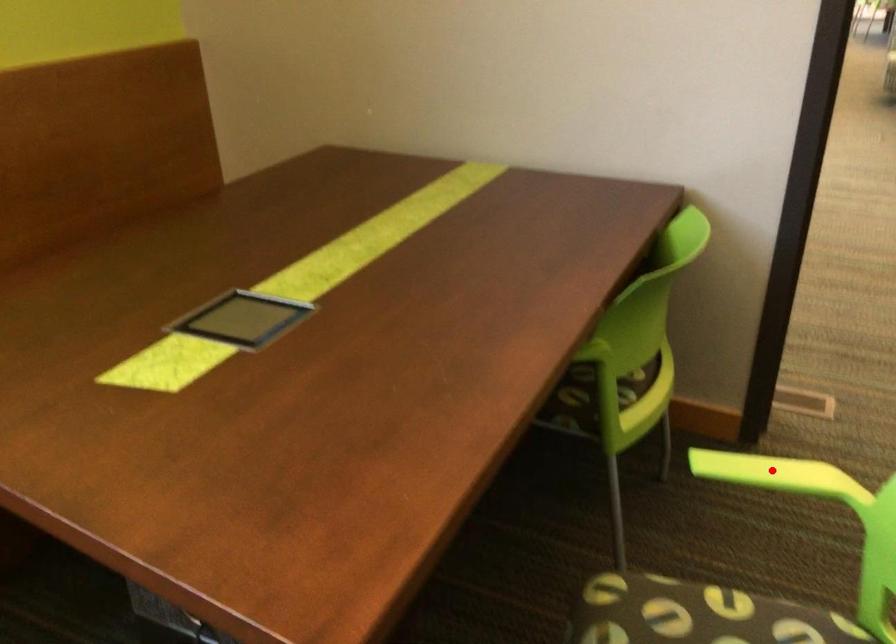
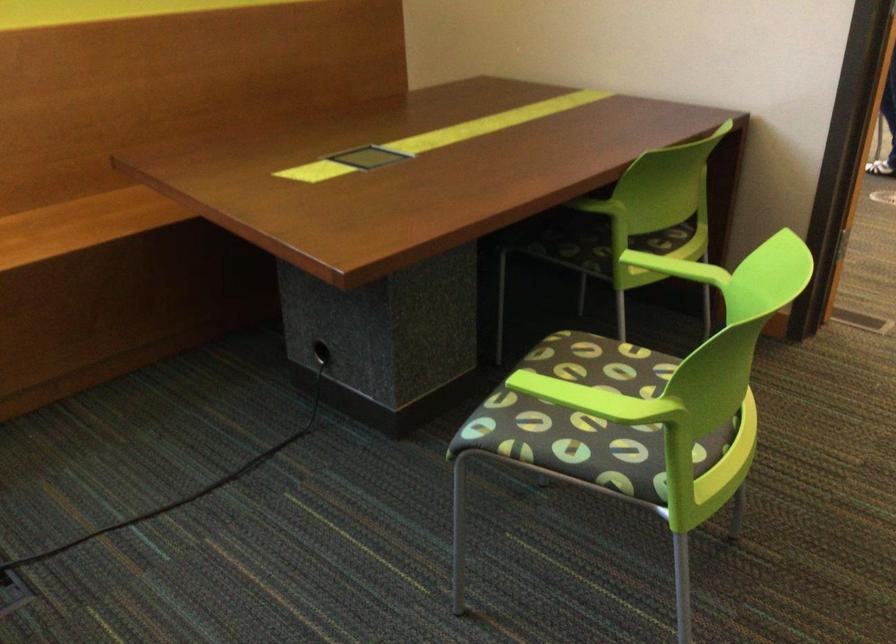
Question: I am providing you with two images of the same scene from different viewpoints. A red point is shown in image1. For the corresponding object point in image2, is it positioned nearer or farther from the camera?

Choices:
 (A) Nearer
 (B) Farther

Answer: (B)